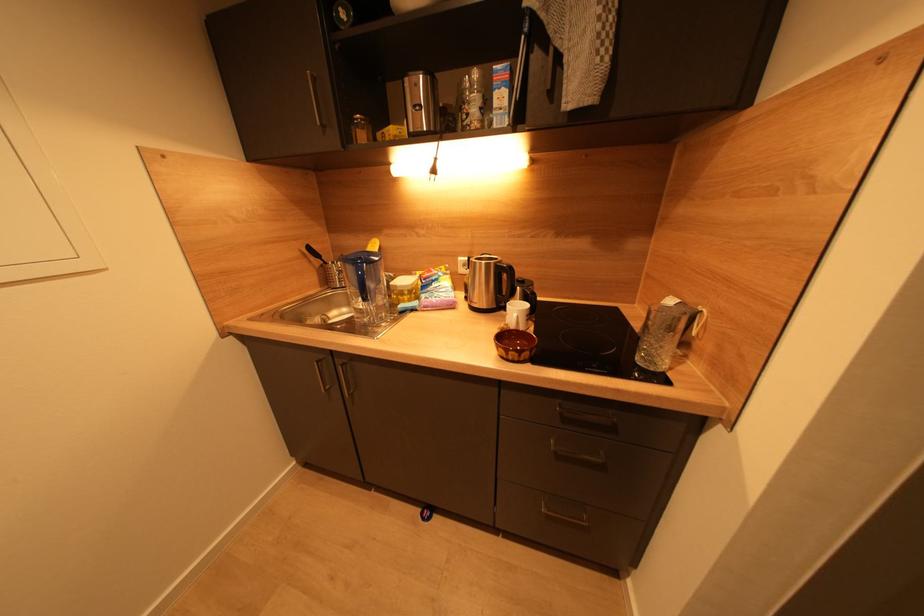
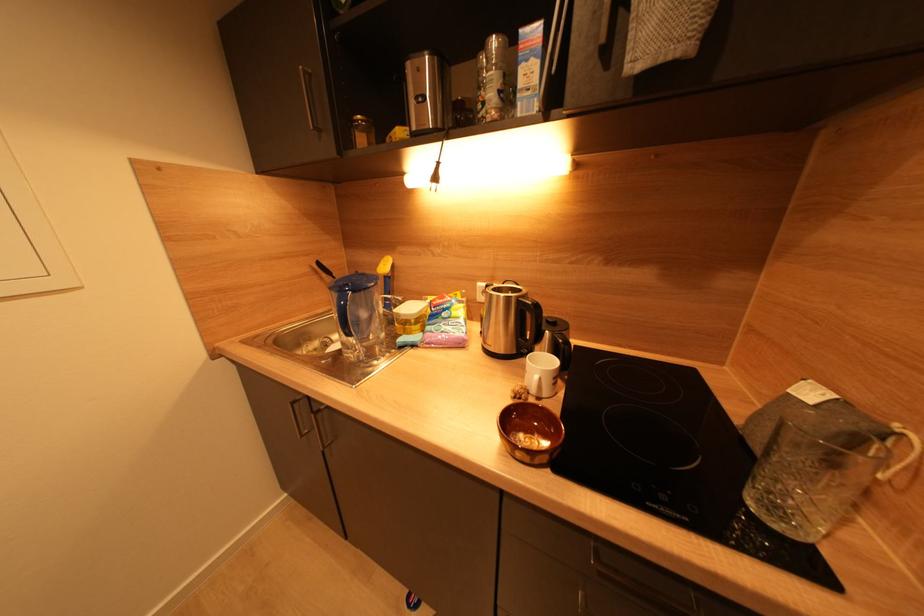
Question: Based on the continuous images, in which direction is the camera rotating? Reply with the corresponding letter.

Choices:
 (A) Left
 (B) Right
 (C) Up
 (D) Down

Answer: (A)